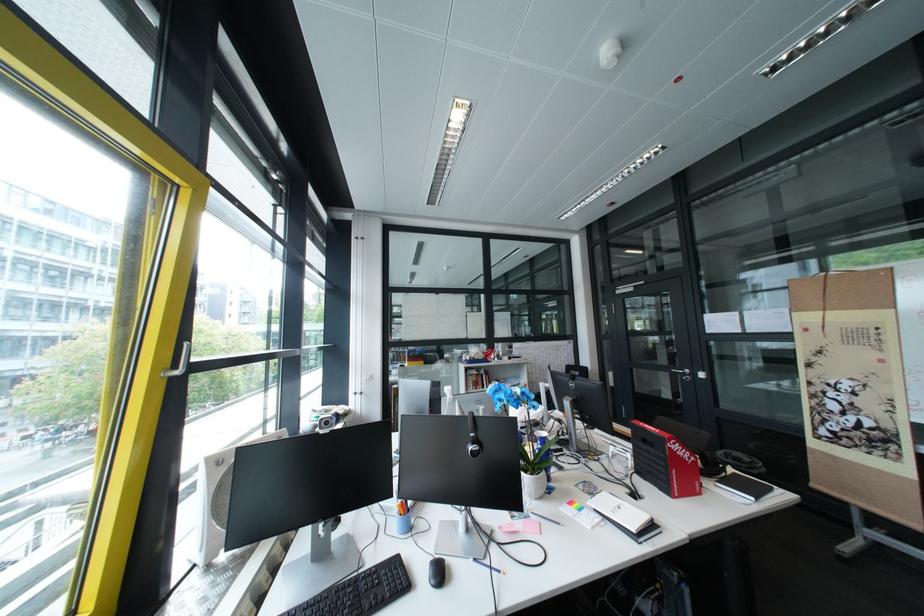
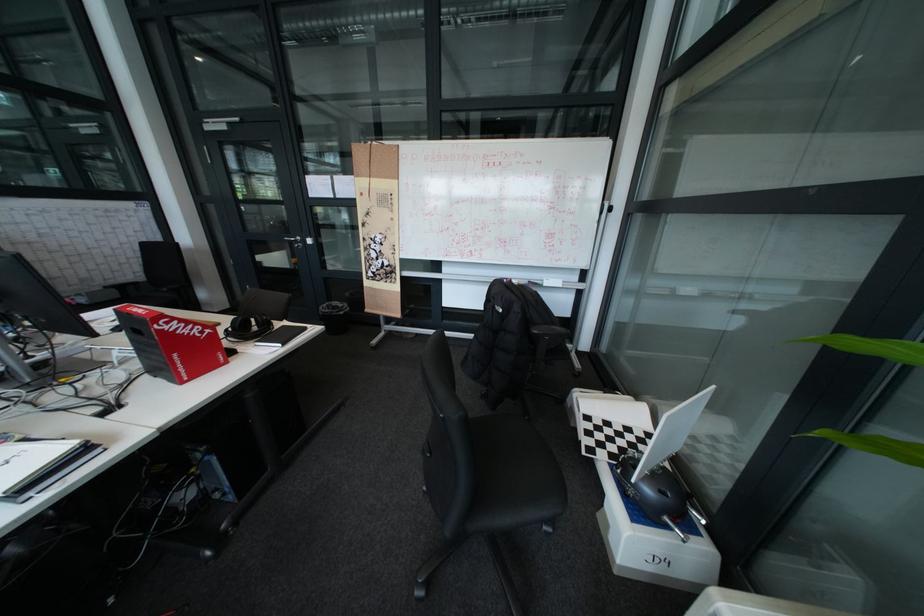
Question: I am providing you with two images of the same scene from different viewpoints. Please identify which objects are invisible in image2.

Choices:
 (A) white laptop
 (B) whiteboard marker
 (C) black chair sitting surface
 (D) none of these

Answer: (D)